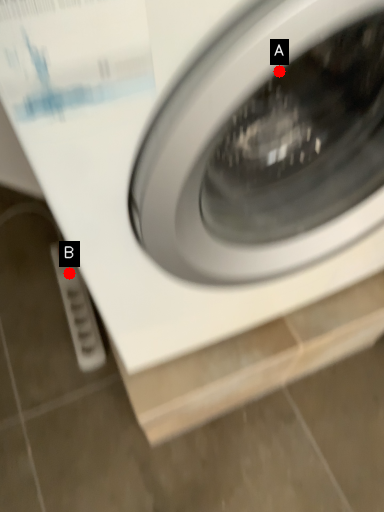
Question: Two points are circled on the image, labeled by A and B beside each circle. Among these points, which one is farthest from the camera?

Choices:
 (A) A is further
 (B) B is further

Answer: (B)